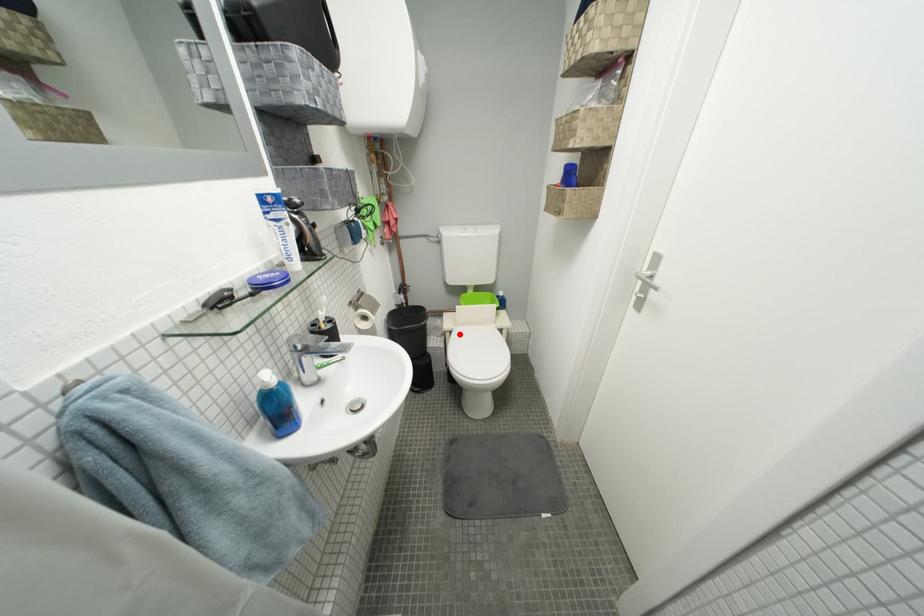
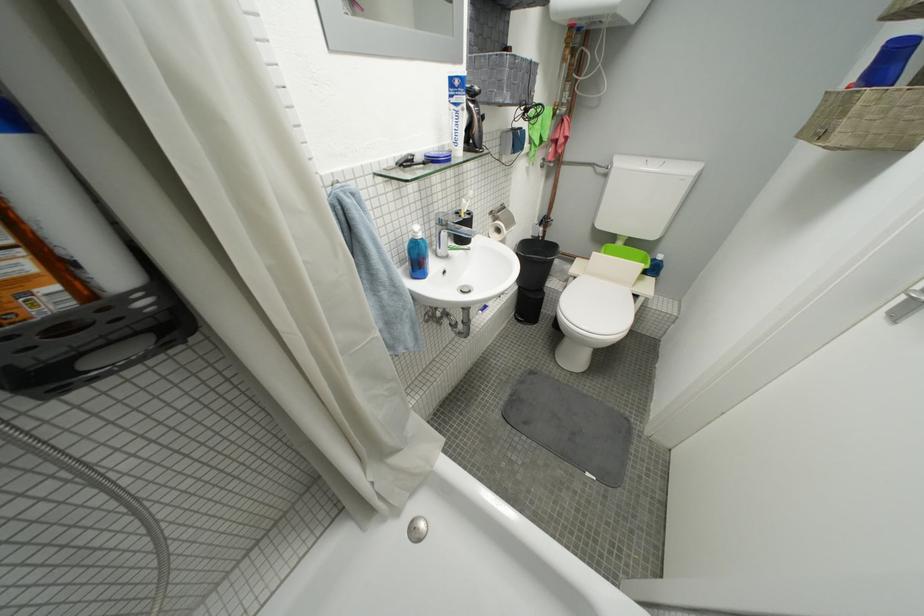
Question: A red point is marked in image1. In image2, is the corresponding 3D point closer to the camera or farther? Reply with the corresponding letter.

Choices:
 (A) The corresponding 3D point is closer.
 (B) The corresponding 3D point is farther.

Answer: (A)